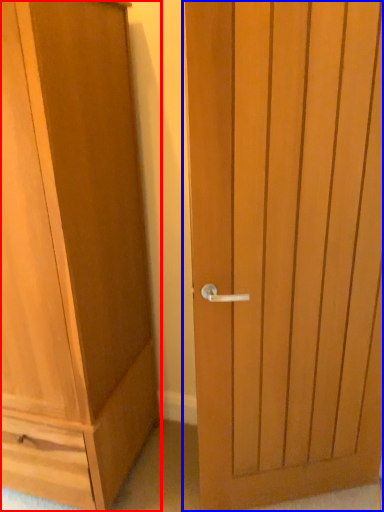
Question: Which of the following is the closest to the observer, cupboard (highlighted by a red box) or door (highlighted by a blue box)?

Choices:
 (A) cupboard
 (B) door

Answer: (A)